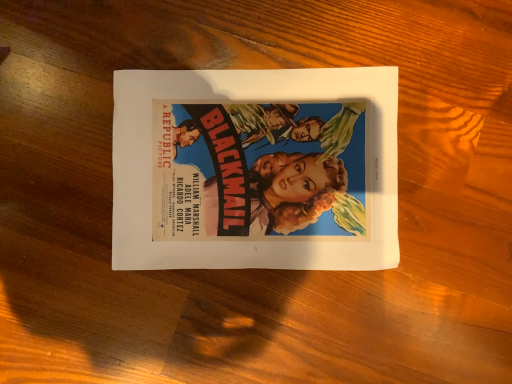
The height and width of the screenshot is (384, 512). I want to click on free point above matte paper poster at center (from a real-world perspective), so click(255, 168).